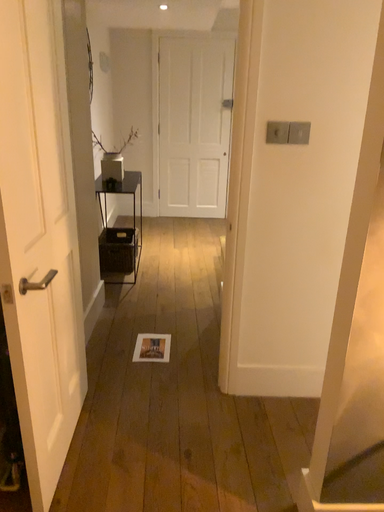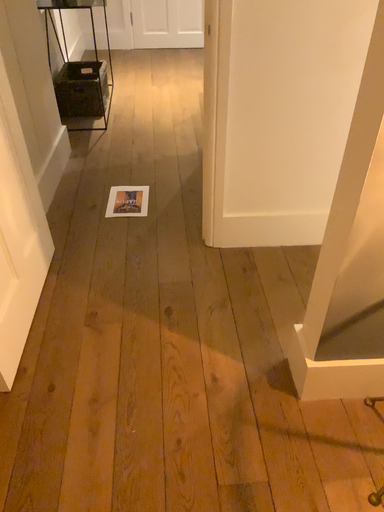
Question: How did the camera likely rotate when shooting the video?

Choices:
 (A) rotated upward
 (B) rotated downward

Answer: (B)